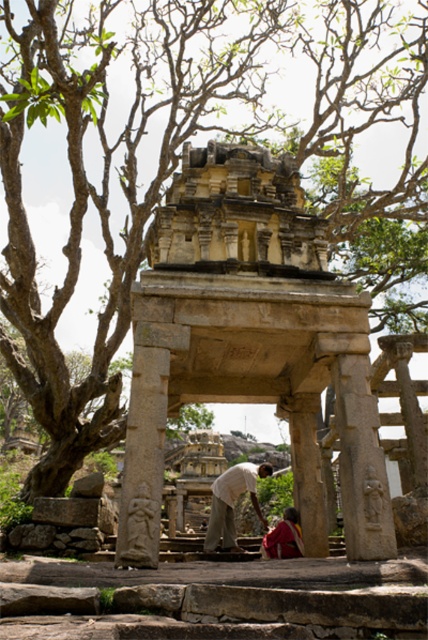
Consider the image. Is light brown cotton shirt at center below red fabric cloth at center?

Indeed, light brown cotton shirt at center is positioned under red fabric cloth at center.

Looking at this image, who is more distant from viewer, (223, 538) or (262, 556)?

The point (223, 538) is behind.

I want to click on light brown cotton shirt at center, so click(x=232, y=502).

What do you see at coordinates (249, 340) in the screenshot?
I see `stone carved temple at center` at bounding box center [249, 340].

Image resolution: width=428 pixels, height=640 pixels. What do you see at coordinates (249, 340) in the screenshot? I see `stone carved temple at center` at bounding box center [249, 340].

Where is `stone carved temple at center`? Image resolution: width=428 pixels, height=640 pixels. stone carved temple at center is located at coordinates (249, 340).

Can you confirm if stone carved temple at center is positioned above red fabric cloth at center?

Yes.

Image resolution: width=428 pixels, height=640 pixels. Describe the element at coordinates (249, 340) in the screenshot. I see `stone carved temple at center` at that location.

Does point (309, 266) lie in front of point (294, 515)?

Yes, it is in front of point (294, 515).

Locate an element on the screen. The width and height of the screenshot is (428, 640). stone carved temple at center is located at coordinates (249, 340).